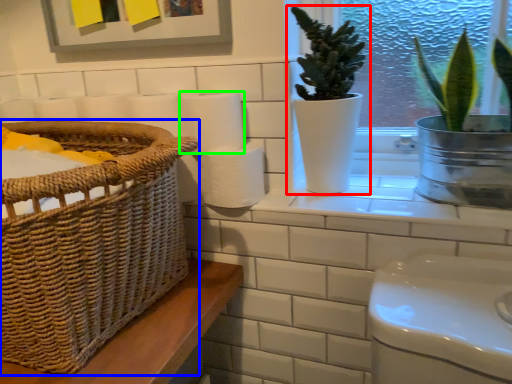
Question: Which is farther away from houseplant (highlighted by a red box)? basket (highlighted by a blue box) or paper towel (highlighted by a green box)?

Choices:
 (A) basket
 (B) paper towel

Answer: (A)